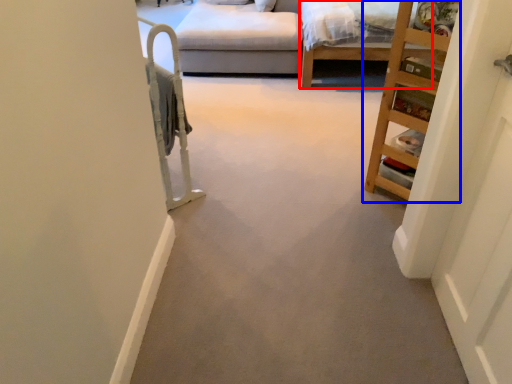
Question: Which of the following is the farthest to the observer, bed frame (highlighted by a red box) or furniture (highlighted by a blue box)?

Choices:
 (A) bed frame
 (B) furniture

Answer: (A)